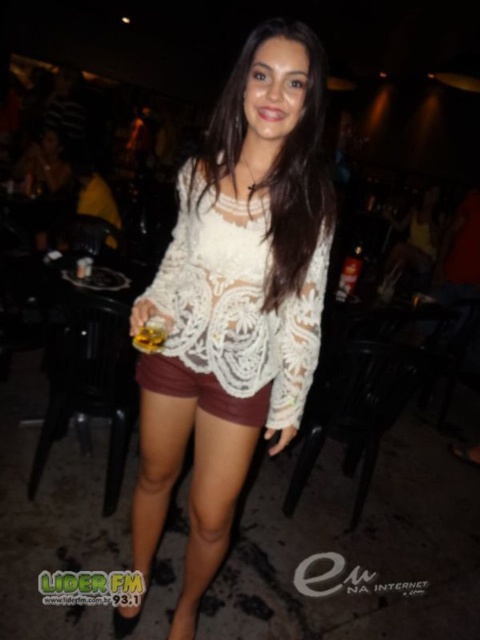
You are a bartender who needs to hand a drink to the woman wearing the white lace blouse at center. The tray you are carrying can extend 1 meter in front of you. Can you reach her without moving closer?

The white lace blouse at center and viewer are 1.18 meters apart. Since the tray can only extend 1 meter, you cannot reach her without moving closer.

You are a fashion designer observing the image. You need to determine which item of clothing is more prominent in the scene. Which one has a larger size between the white lace top at center and the white lace dress at center?

The white lace top at center has a larger size compared to the white lace dress at center, so the white lace top at center is more prominent in the scene.